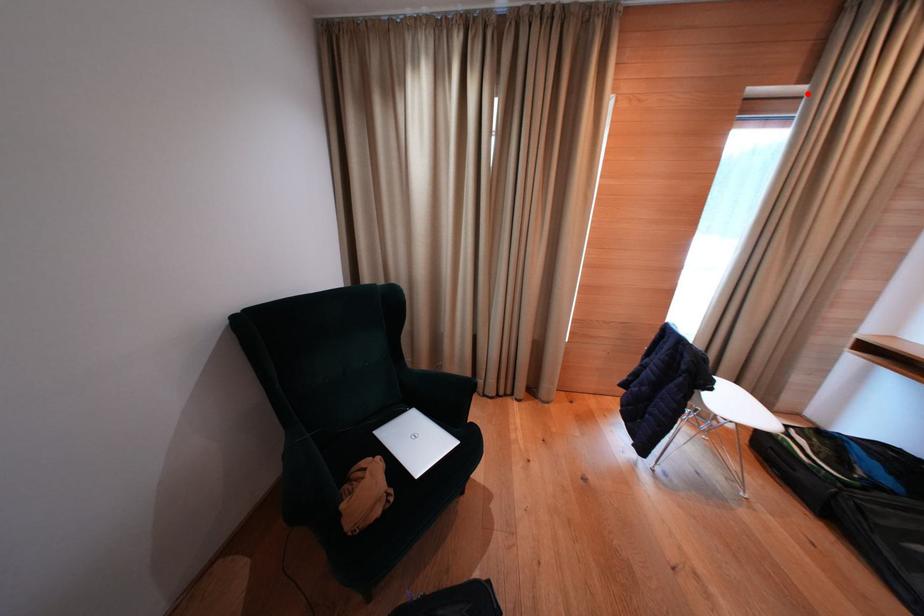
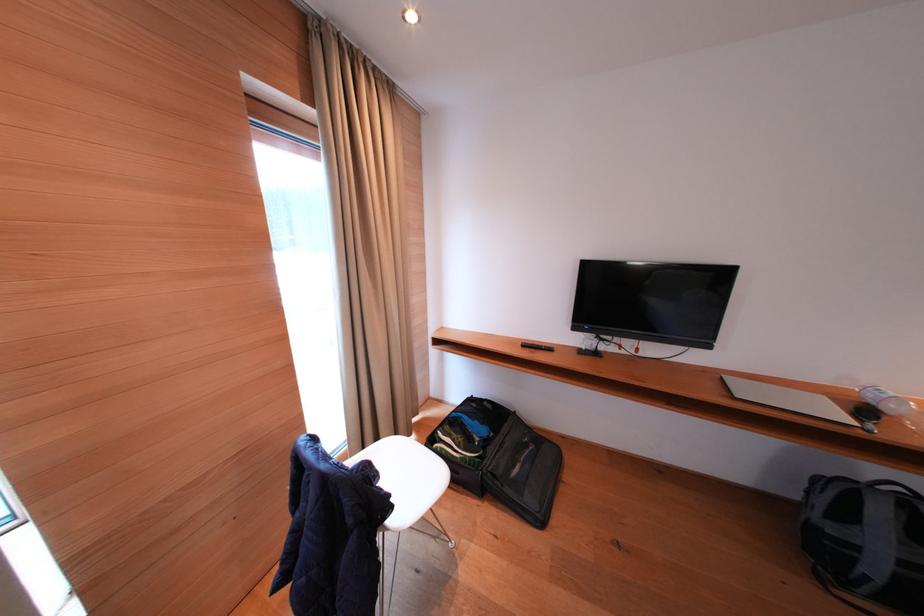
In the second image, find the point that corresponds to the highlighted location in the first image.

(317, 116)